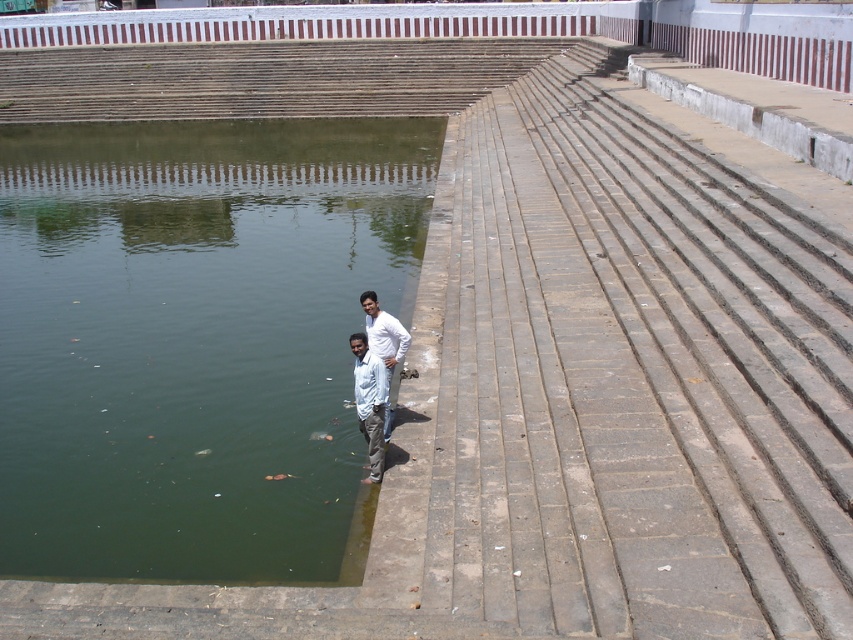
Between point (289, 515) and point (389, 349), which one is positioned in front?

Point (289, 515) is in front.

Can you confirm if green concrete lake at lower left is shorter than white matte shirt at lower center?

No, green concrete lake at lower left is not shorter than white matte shirt at lower center.

Is point (131, 125) positioned in front of point (383, 326)?

No, it is behind (383, 326).

The width and height of the screenshot is (853, 640). Identify the location of green concrete lake at lower left. (192, 339).

Looking at this image, is green concrete lake at lower left smaller than white cotton shirt at lower center?

Actually, green concrete lake at lower left might be larger than white cotton shirt at lower center.

Is green concrete lake at lower left shorter than white cotton shirt at lower center?

No, green concrete lake at lower left is not shorter than white cotton shirt at lower center.

Is point (222, 529) closer to camera compared to point (379, 385)?

Yes.

Locate an element on the screen. The height and width of the screenshot is (640, 853). green concrete lake at lower left is located at coordinates (192, 339).

Is the position of white cotton shirt at lower center less distant than that of white matte shirt at lower center?

Yes.

Is point (366, 477) positioned in front of point (367, 308)?

Yes, it is.

You are a GUI agent. You are given a task and a screenshot of the screen. Output one action in this format:
    pyautogui.click(x=<x>, y=<y>)
    Task: Click on the white cotton shirt at lower center
    The width and height of the screenshot is (853, 640).
    Given the screenshot: What is the action you would take?
    pyautogui.click(x=369, y=401)